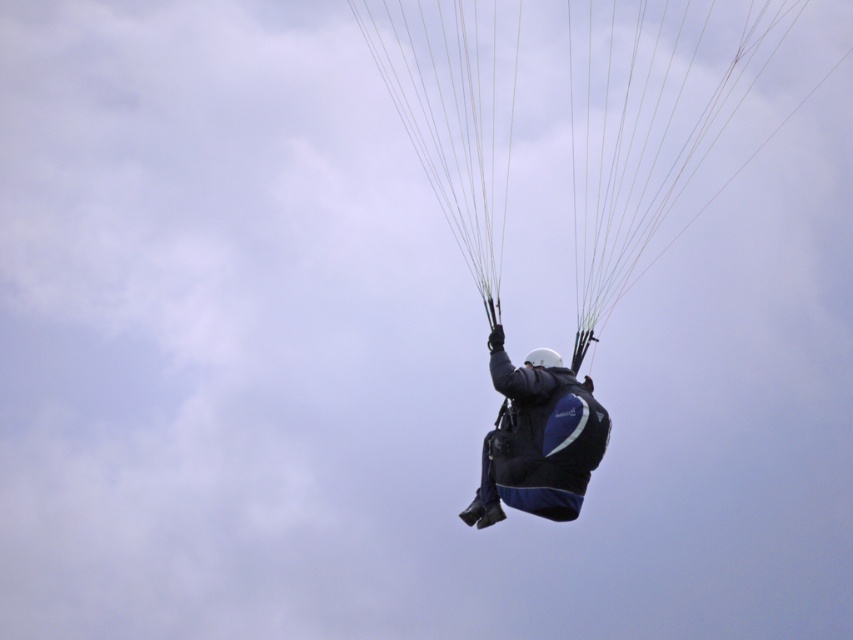
Does blue fabric parachute at center have a lesser height compared to dark blue fabric parachute at center?

In fact, blue fabric parachute at center may be taller than dark blue fabric parachute at center.

Does blue fabric parachute at center have a greater height compared to dark blue fabric parachute at center?

Correct, blue fabric parachute at center is much taller as dark blue fabric parachute at center.

At what (x,y) coordinates should I click in order to perform the action: click on blue fabric parachute at center. Please return your answer as a coordinate pair (x, y). The height and width of the screenshot is (640, 853). Looking at the image, I should click on (643, 129).

Where is `blue fabric parachute at center`? The height and width of the screenshot is (640, 853). blue fabric parachute at center is located at coordinates (643, 129).